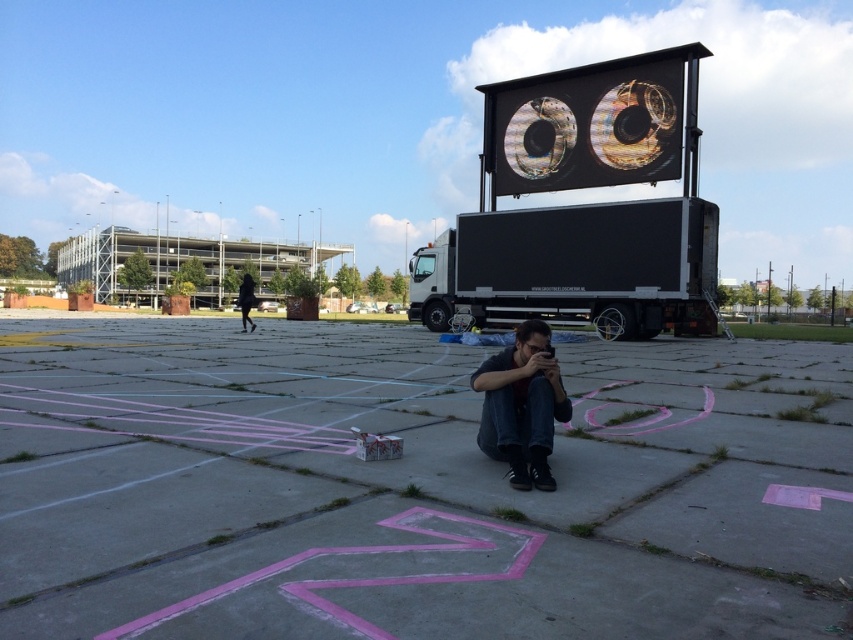
Question: Is dark blue jeans at center to the left of black fabric at left from the viewer's perspective?

Choices:
 (A) yes
 (B) no

Answer: (B)

Question: Can you confirm if black matte trailer truck at upper center is positioned above dark blue jeans at center?

Choices:
 (A) yes
 (B) no

Answer: (A)

Question: Which of these objects is positioned closest to the dark blue jeans at center?

Choices:
 (A) black matte trailer truck at upper center
 (B) black matte trailer truck at center

Answer: (B)

Question: Is black matte trailer truck at center below black fabric at left?

Choices:
 (A) no
 (B) yes

Answer: (A)

Question: Which object is closer to the camera taking this photo?

Choices:
 (A) black matte trailer truck at upper center
 (B) black matte trailer truck at center
 (C) dark blue jeans at center

Answer: (C)

Question: Which point is farther from the camera taking this photo?

Choices:
 (A) (606, 216)
 (B) (469, 378)
 (C) (683, 317)
 (D) (293, 570)

Answer: (C)